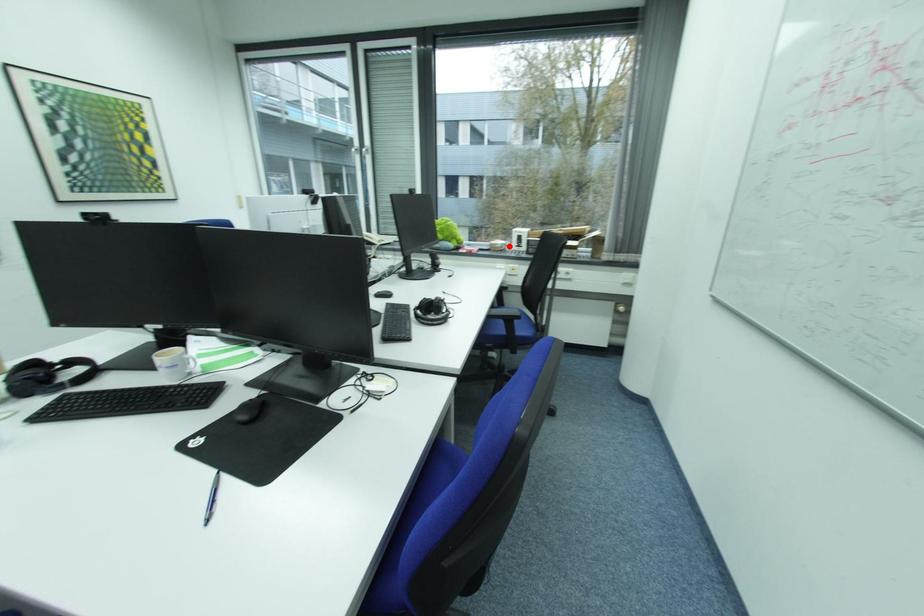
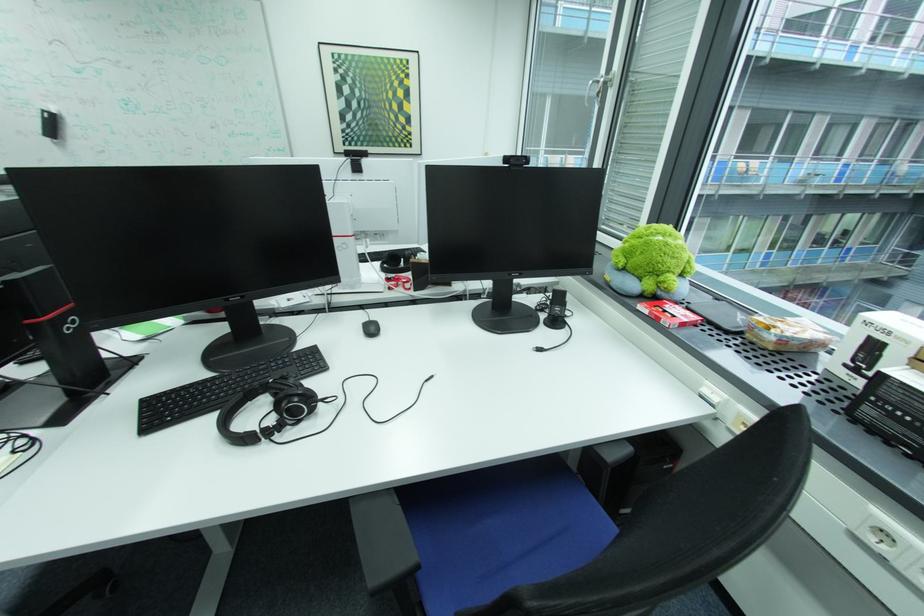
Locate, in the second image, the point that corresponds to the highlighted location in the first image.

(781, 339)